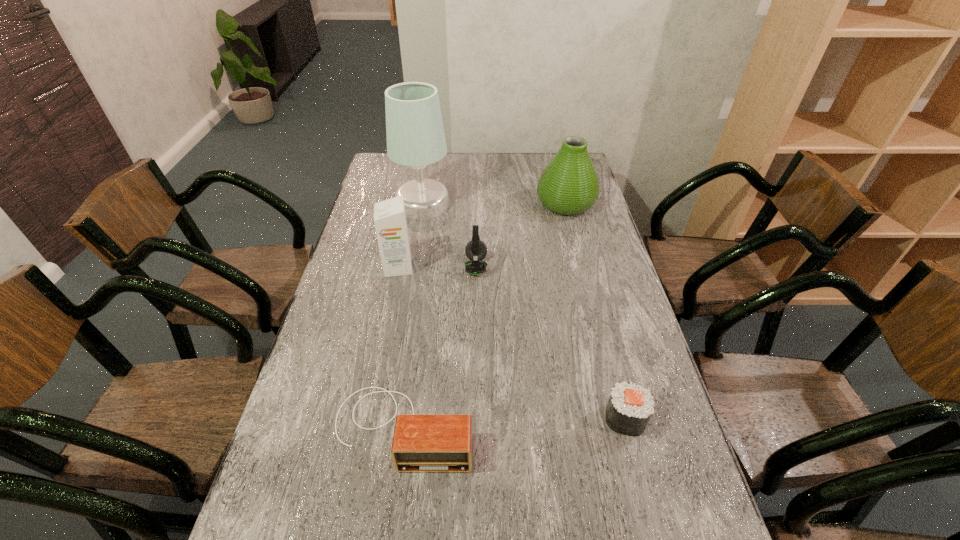
Image resolution: width=960 pixels, height=540 pixels. I want to click on free space located 0.060m on the front-facing side of the radio receiver, so click(393, 503).

The height and width of the screenshot is (540, 960). What are the coordinates of `vacant space located 0.130m on the left of the sushi` in the screenshot? It's located at (550, 418).

The height and width of the screenshot is (540, 960). What are the coordinates of `lampshade that is positioned at the left edge` in the screenshot? It's located at (415, 135).

Locate an element on the screen. carton that is at the left edge is located at coordinates (390, 221).

Locate an element on the screen. Image resolution: width=960 pixels, height=540 pixels. radio receiver at the left edge is located at coordinates (421, 443).

Locate an element on the screen. The height and width of the screenshot is (540, 960). vase that is at the right edge is located at coordinates (569, 185).

The height and width of the screenshot is (540, 960). I want to click on sushi that is at the right edge, so click(x=630, y=406).

The image size is (960, 540). I want to click on free region at the far edge of the desktop, so click(x=514, y=158).

I want to click on vacant space at the left edge of the desktop, so click(367, 269).

You are a GUI agent. You are given a task and a screenshot of the screen. Output one action in this format:
    pyautogui.click(x=<x>, y=<y>)
    Task: Click on the free space at the right edge
    
    Given the screenshot: What is the action you would take?
    pyautogui.click(x=599, y=212)